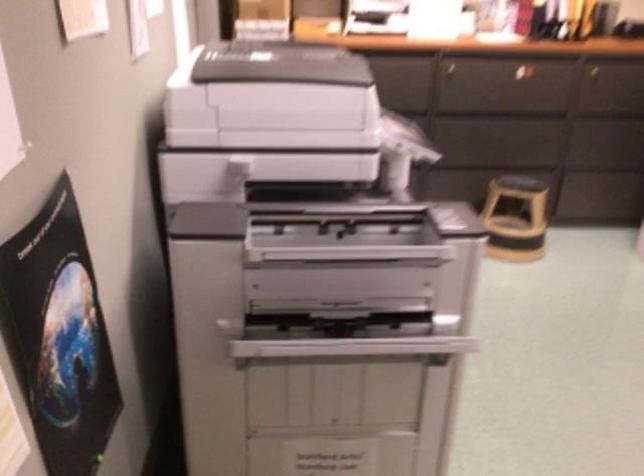
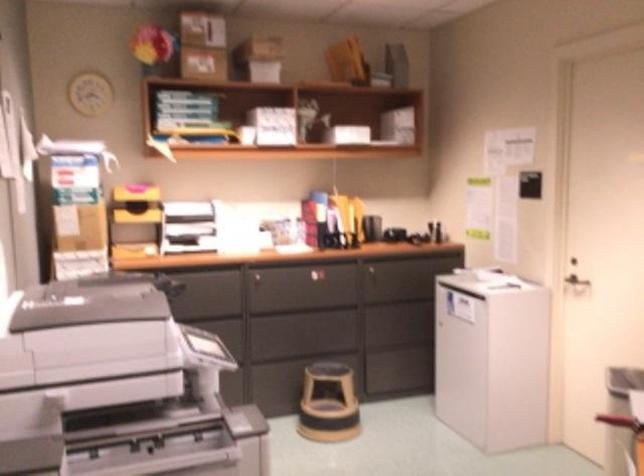
Question: In a continuous first-person perspective shot, in which direction is the camera moving?

Choices:
 (A) Left
 (B) Right
 (C) Forward
 (D) Backward

Answer: (D)